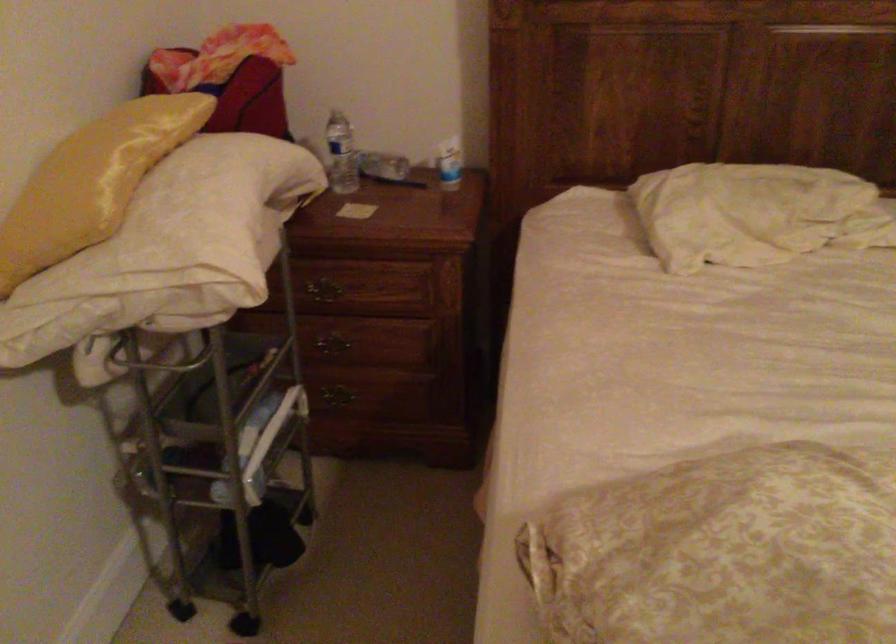
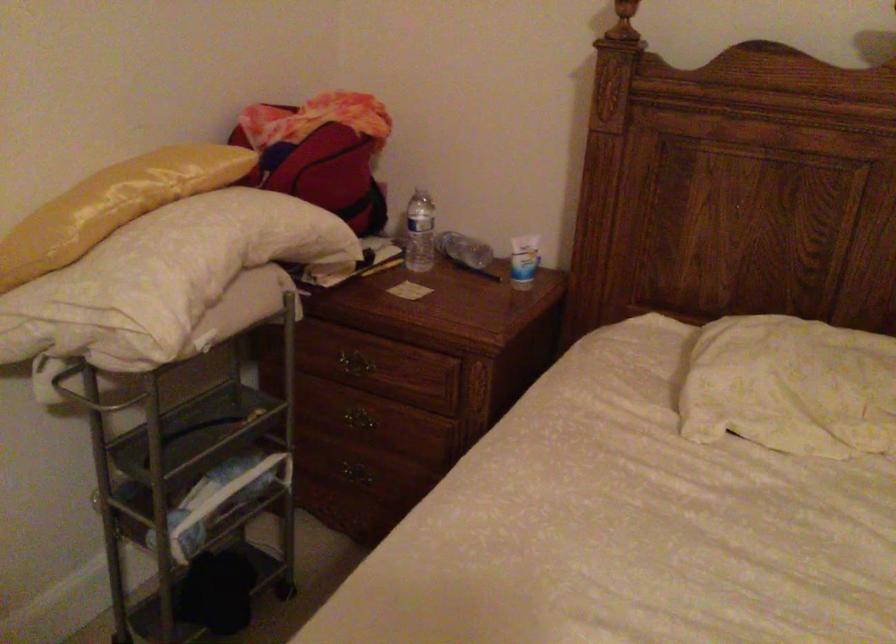
Find the pixel in the second image that matches the point at 224,230 in the first image.

(164, 278)